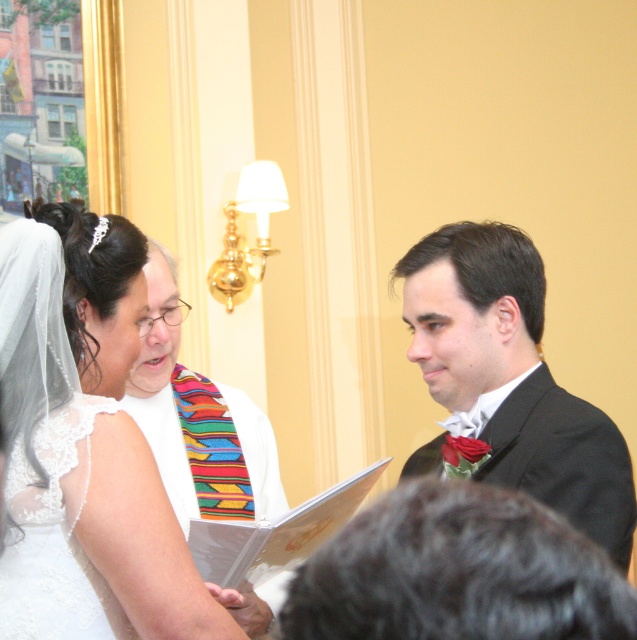
Question: Among these points, which one is nearest to the camera?

Choices:
 (A) (582, 573)
 (B) (129, 618)
 (C) (96, 436)

Answer: (A)

Question: Which of these objects is positioned closest to the white lace wedding dress at lower left?

Choices:
 (A) matte black suit at center
 (B) white satin dress at center
 (C) white lace veil at upper left

Answer: (B)

Question: Can you confirm if white satin dress at center is positioned to the left of white lace veil at upper left?

Choices:
 (A) no
 (B) yes

Answer: (B)

Question: Does white lace veil at upper left have a smaller size compared to white lace wedding dress at lower left?

Choices:
 (A) no
 (B) yes

Answer: (A)

Question: Which object is closer to the camera taking this photo?

Choices:
 (A) white lace veil at upper left
 (B) matte black suit at center
 (C) white lace wedding dress at lower left
 (D) black satin suit at center

Answer: (D)

Question: Is white lace veil at upper left bigger than matte black suit at center?

Choices:
 (A) yes
 (B) no

Answer: (B)